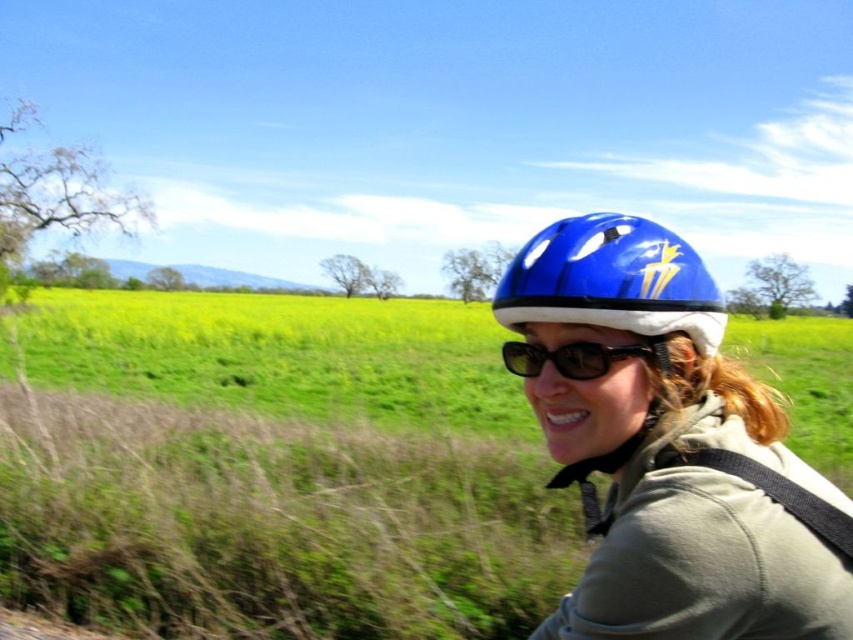
Can you confirm if green grass at center is positioned below blue matte helmet at upper right?

No.

Which of these two, green grass at center or blue matte helmet at upper right, stands taller?

green grass at center

Locate an element on the screen. The width and height of the screenshot is (853, 640). green grass at center is located at coordinates (274, 468).

Between blue matte helmet at upper right and black plastic sunglasses at center, which one is positioned lower?

Positioned lower is black plastic sunglasses at center.

Who is more distant from viewer, [550,259] or [512,371]?

The point [512,371] is more distant.

Locate an element on the screen. This screenshot has height=640, width=853. blue matte helmet at upper right is located at coordinates (612, 280).

Between blue matte helmet at center and black plastic sunglasses at center, which one appears on the right side from the viewer's perspective?

blue matte helmet at center is more to the right.

Locate an element on the screen. blue matte helmet at center is located at coordinates (669, 449).

Measure the distance between blue matte helmet at center and camera.

They are 36.26 inches apart.

You are a GUI agent. You are given a task and a screenshot of the screen. Output one action in this format:
    pyautogui.click(x=<x>, y=<y>)
    Task: Click on the blue matte helmet at center
    The width and height of the screenshot is (853, 640).
    Given the screenshot: What is the action you would take?
    pyautogui.click(x=669, y=449)